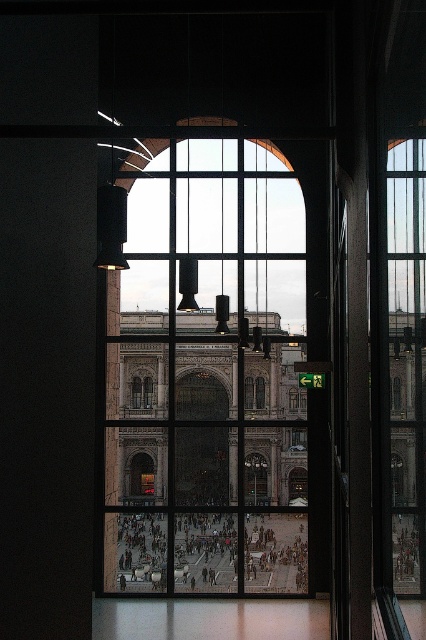
You are an interior designer planning to hang a large decorative mirror between the clear glass window at center and the clear glass window at right. Considering their sizes, which window should the mirror be placed closer to for balance?

The clear glass window at center is larger than the clear glass window at right, so the mirror should be placed closer to the clear glass window at center to achieve visual balance.

You are an interior designer assessing the lighting in a room with two clear glass windows. The clear glass window at center and the clear glass window at right are part of an arched window frame. Which window allows more natural light into the room based on their heights?

The clear glass window at center allows more natural light into the room because it has a greater height compared to the clear glass window at right.